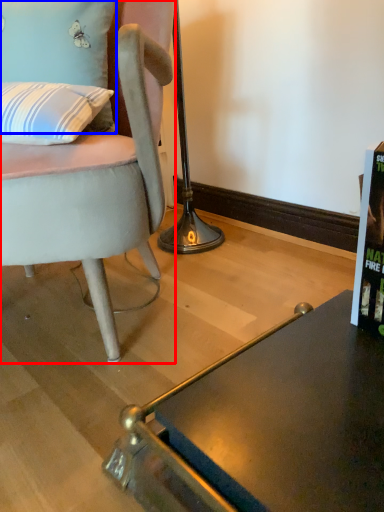
Question: Among these objects, which one is farthest to the camera, chair (highlighted by a red box) or pillow (highlighted by a blue box)?

Choices:
 (A) chair
 (B) pillow

Answer: (B)